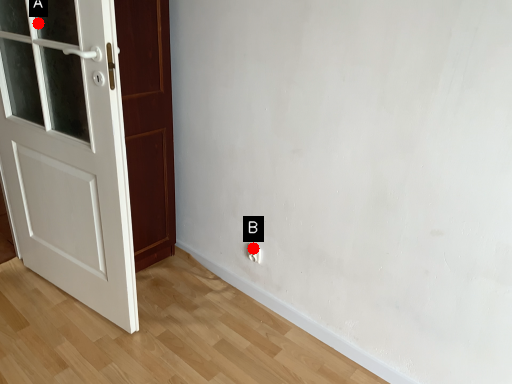
Question: Two points are circled on the image, labeled by A and B beside each circle. Among these points, which one is nearest to the camera?

Choices:
 (A) A is closer
 (B) B is closer

Answer: (A)